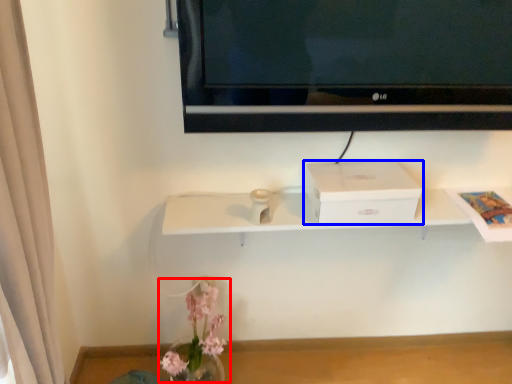
Question: Among these objects, which one is farthest to the camera, floral arrangement (highlighted by a red box) or box (highlighted by a blue box)?

Choices:
 (A) floral arrangement
 (B) box

Answer: (B)